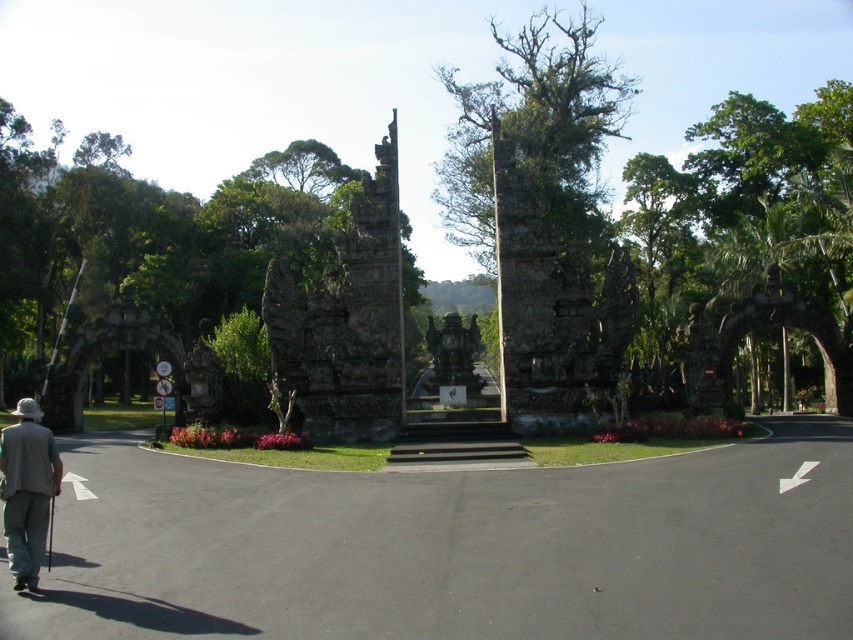
You are standing in front of the grand entrance gate and want to take a photo of the green rough stone tree at upper center. Where should you position yourself to capture the tree in the center of your camera viewfinder?

To capture the green rough stone stone tree at upper center in the center of your camera viewfinder, position yourself directly in front of the tree at point (537, 136). This will ensure the tree is centered in your shot.

You are standing at the entrance gate and want to locate two specific points marked in the image. The first point is at coordinates point (137, 280) and the second is at point (439, 369). Which point is closer to you when facing the gate?

Point (439, 369) is closer to you because point (137, 280) is behind it.